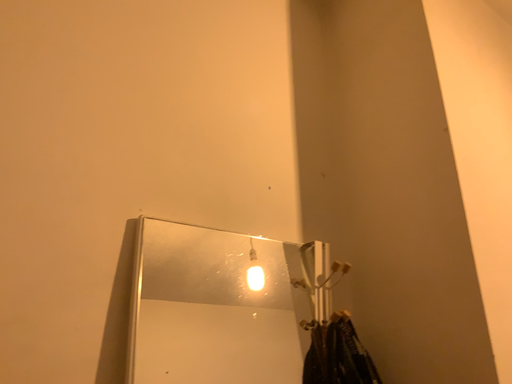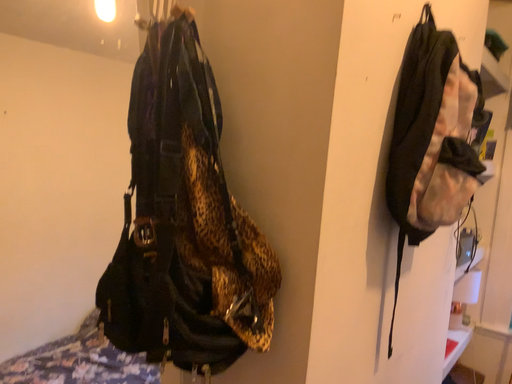
Question: How did the camera likely rotate when shooting the video?

Choices:
 (A) rotated upward
 (B) rotated downward

Answer: (B)